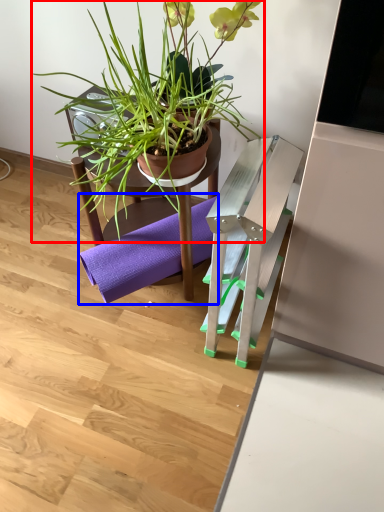
Question: Which object appears farthest to the camera in this image, houseplant (highlighted by a red box) or yoga mat (highlighted by a blue box)?

Choices:
 (A) houseplant
 (B) yoga mat

Answer: (B)